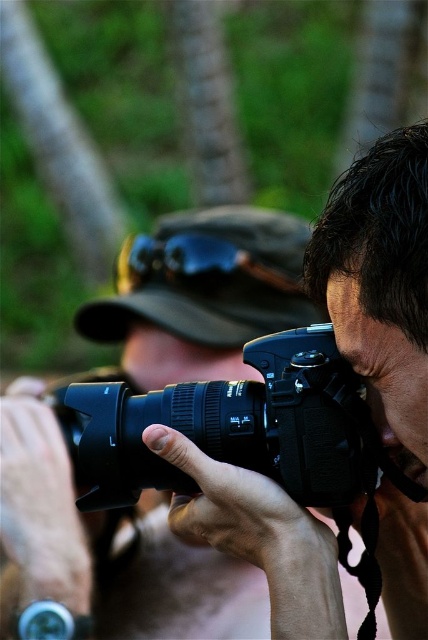
Question: Can you confirm if black matte camera at center is wider than black plastic camera at center?

Choices:
 (A) yes
 (B) no

Answer: (A)

Question: Among these objects, which one is nearest to the camera?

Choices:
 (A) black matte camera at center
 (B) black plastic camera at center

Answer: (B)

Question: Does black matte camera at center lie in front of black plastic camera at center?

Choices:
 (A) no
 (B) yes

Answer: (A)

Question: Among these points, which one is nearest to the camera?

Choices:
 (A) (145, 333)
 (B) (344, 481)

Answer: (B)

Question: From the image, what is the correct spatial relationship of black matte camera at center in relation to black plastic camera at center?

Choices:
 (A) below
 (B) above

Answer: (A)